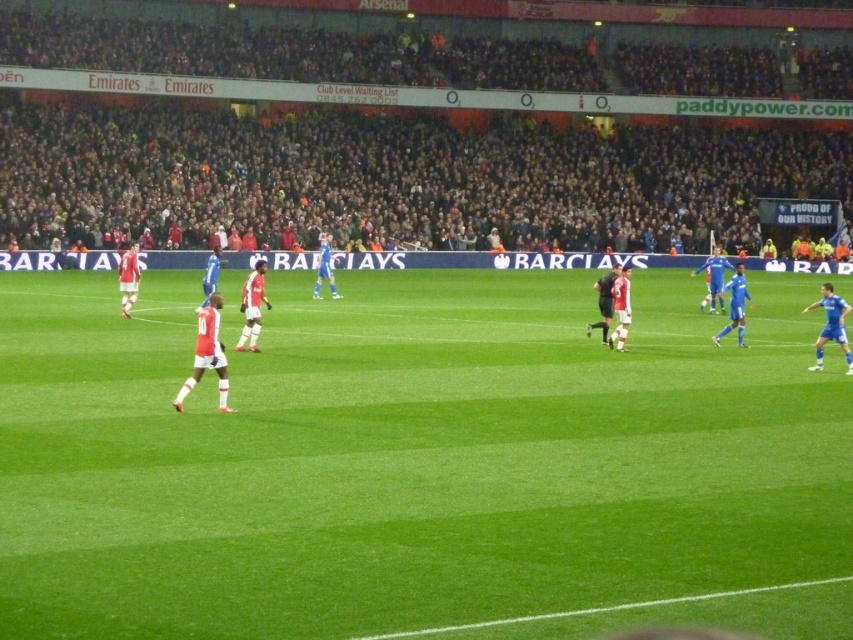
Image resolution: width=853 pixels, height=640 pixels. What do you see at coordinates (419, 465) in the screenshot? I see `green grass field at center` at bounding box center [419, 465].

Between green grass field at center and dark gray crowd at upper center, which one appears on the left side from the viewer's perspective?

green grass field at center is more to the left.

Does point (340, 307) come farther from viewer compared to point (474, 67)?

That is False.

This screenshot has width=853, height=640. Find the location of `green grass field at center`. green grass field at center is located at coordinates (419, 465).